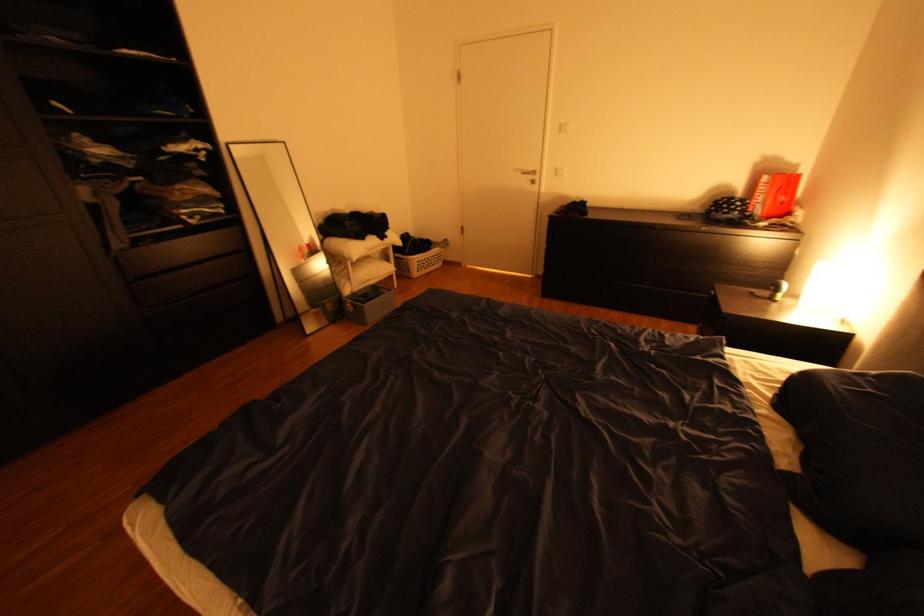
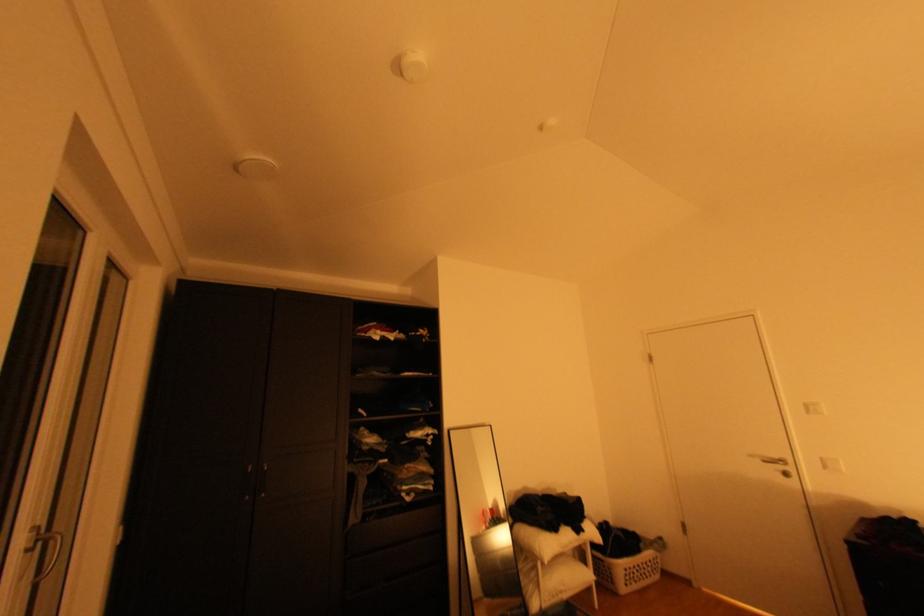
Locate, in the second image, the point that corresponds to the point at 433,264 in the first image.

(642, 573)